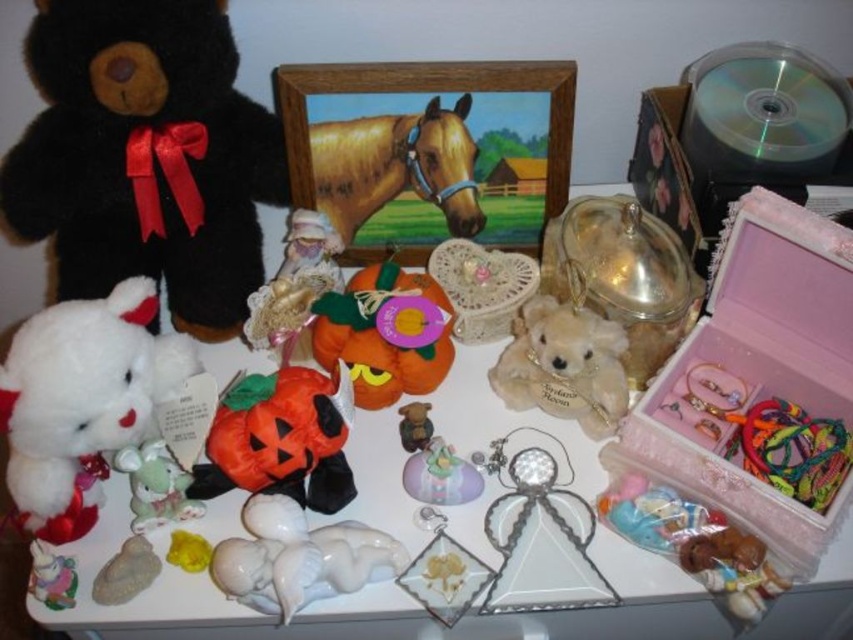
Who is more distant from viewer, (276, 196) or (287, 580)?

The point (276, 196) is behind.

The height and width of the screenshot is (640, 853). What are the coordinates of `black plush bear at left` in the screenshot? It's located at (144, 156).

At what (x,y) coordinates should I click in order to perform the action: click on black plush bear at left. Please return your answer as a coordinate pair (x, y). Looking at the image, I should click on (144, 156).

Who is shorter, porcelain mouse at lower left or matte ceramic figurine at center?

With less height is matte ceramic figurine at center.

Can you confirm if porcelain mouse at lower left is positioned above matte ceramic figurine at center?

Actually, porcelain mouse at lower left is below matte ceramic figurine at center.

Where is `porcelain mouse at lower left`? The height and width of the screenshot is (640, 853). porcelain mouse at lower left is located at coordinates (155, 484).

Does matte gold bear at center appear on the left side of porcelain horse at lower left?

No, matte gold bear at center is not to the left of porcelain horse at lower left.

This screenshot has height=640, width=853. What do you see at coordinates (564, 365) in the screenshot? I see `matte gold bear at center` at bounding box center [564, 365].

Locate an element on the screen. This screenshot has height=640, width=853. matte gold bear at center is located at coordinates (564, 365).